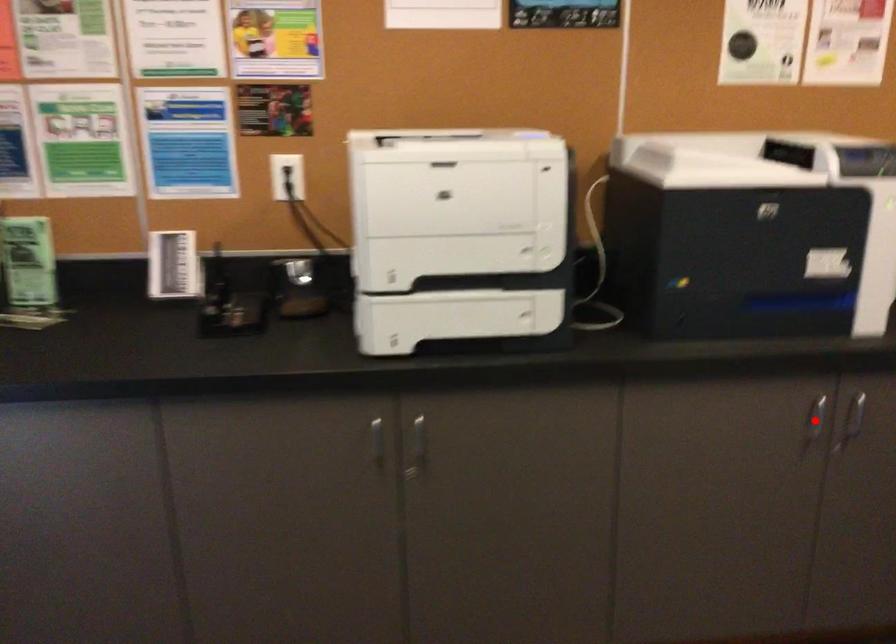
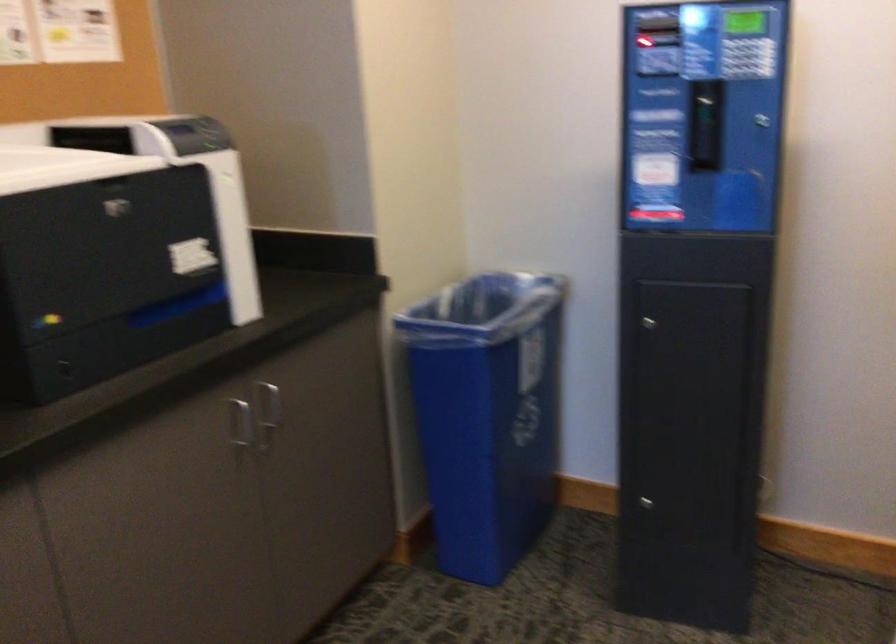
Find the pixel in the second image that matches the highlighted location in the first image.

(239, 424)